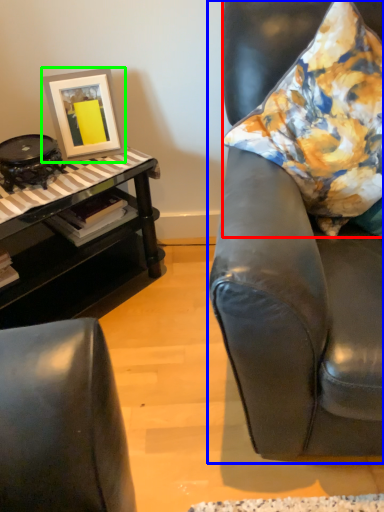
Question: Estimate the real-world distances between objects in this image. Which object is farther from pillow (highlighted by a red box), chair (highlighted by a blue box) or picture frame (highlighted by a green box)?

Choices:
 (A) chair
 (B) picture frame

Answer: (B)